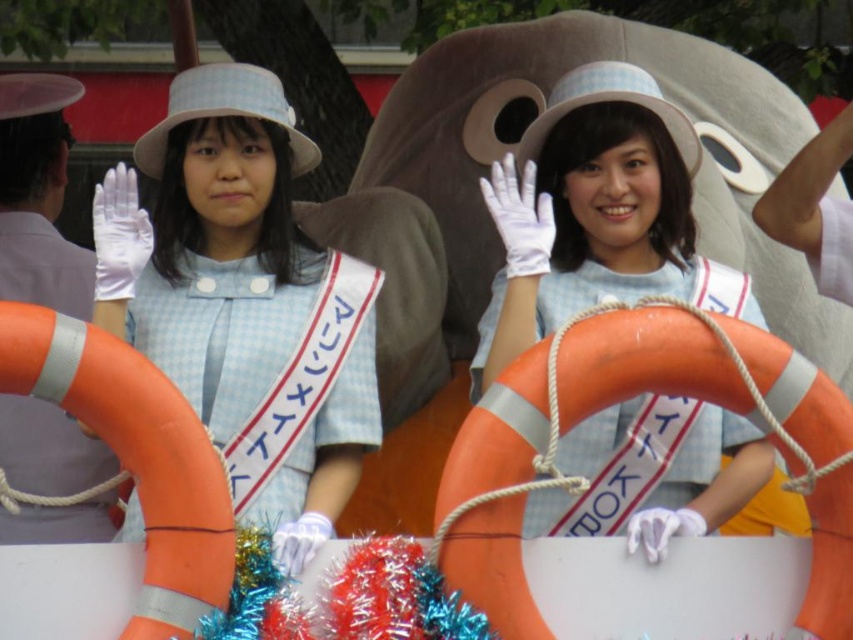
Question: Does matte blue dress at center have a lesser width compared to matte blue sailor dress at center?

Choices:
 (A) yes
 (B) no

Answer: (A)

Question: Among these points, which one is nearest to the camera?

Choices:
 (A) (648, 163)
 (B) (167, 236)

Answer: (A)

Question: Among these points, which one is farthest from the camera?

Choices:
 (A) (223, 147)
 (B) (634, 124)

Answer: (A)

Question: Is matte blue dress at center positioned at the back of matte blue sailor dress at center?

Choices:
 (A) yes
 (B) no

Answer: (B)

Question: Is matte blue dress at center smaller than matte blue sailor dress at center?

Choices:
 (A) no
 (B) yes

Answer: (A)